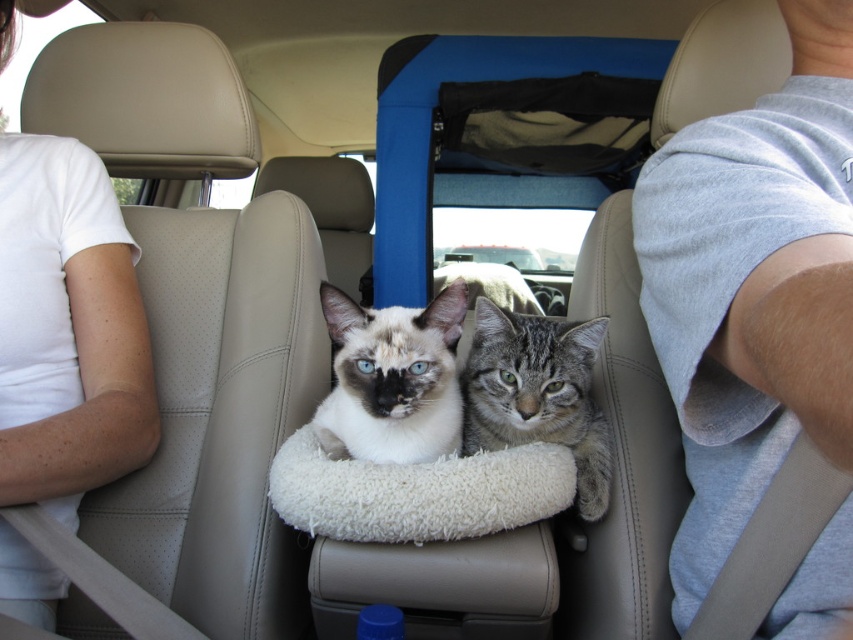
Based on the photo, does white fur cat at center appear under gray tabby cat at center?

No, white fur cat at center is not below gray tabby cat at center.

Where is `white fur cat at center`? white fur cat at center is located at coordinates (392, 378).

Is point (456, 401) in front of point (608, 490)?

Yes.

Find the location of a particular element. The width and height of the screenshot is (853, 640). white fur cat at center is located at coordinates (392, 378).

Between point (831, 292) and point (407, 490), which one is positioned behind?

The point (407, 490) is behind.

Describe the element at coordinates (753, 288) in the screenshot. I see `gray cotton shirt at upper right` at that location.

The height and width of the screenshot is (640, 853). Find the location of `gray cotton shirt at upper right`. gray cotton shirt at upper right is located at coordinates (753, 288).

Looking at this image, is gray cotton shirt at upper right shorter than white fur cat at center?

Incorrect, gray cotton shirt at upper right's height does not fall short of white fur cat at center's.

Is gray cotton shirt at upper right wider than white fur cat at center?

Correct, the width of gray cotton shirt at upper right exceeds that of white fur cat at center.

Locate an element on the screen. The image size is (853, 640). gray cotton shirt at upper right is located at coordinates (753, 288).